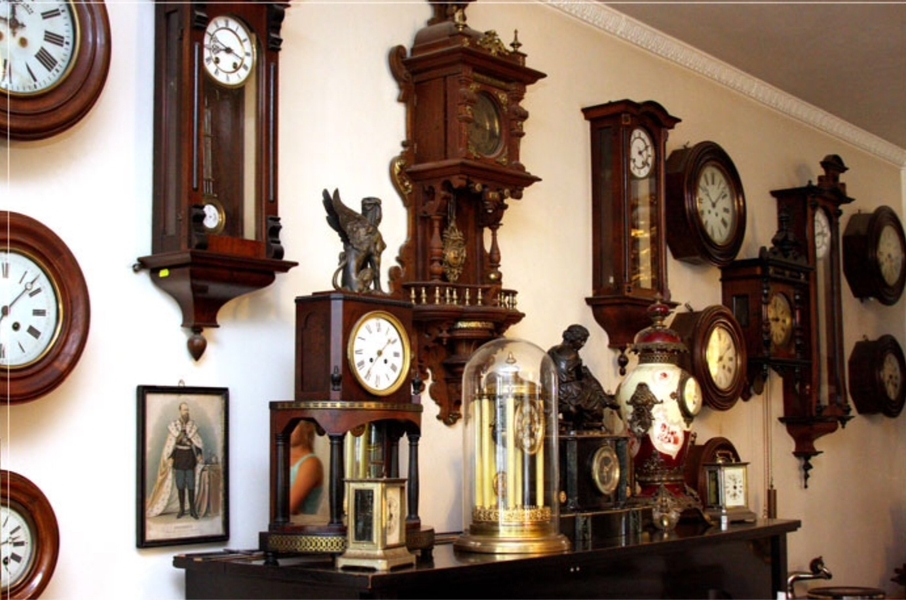
Locate an element on the screen. clocks on wooden table is located at coordinates (x=726, y=477), (x=681, y=431), (x=577, y=427), (x=533, y=461), (x=352, y=381), (x=323, y=419), (x=378, y=517).